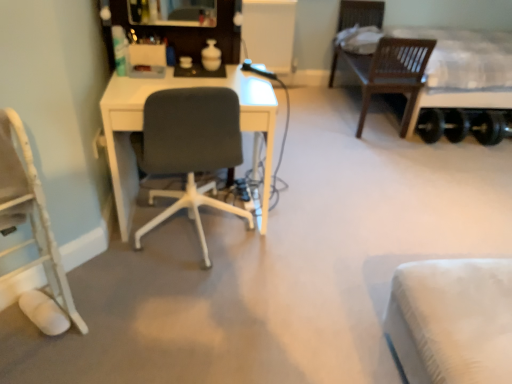
Find the location of a particular element. free space on the front side of matte gray chair at center, acting as the second chair starting from the left is located at coordinates (188, 317).